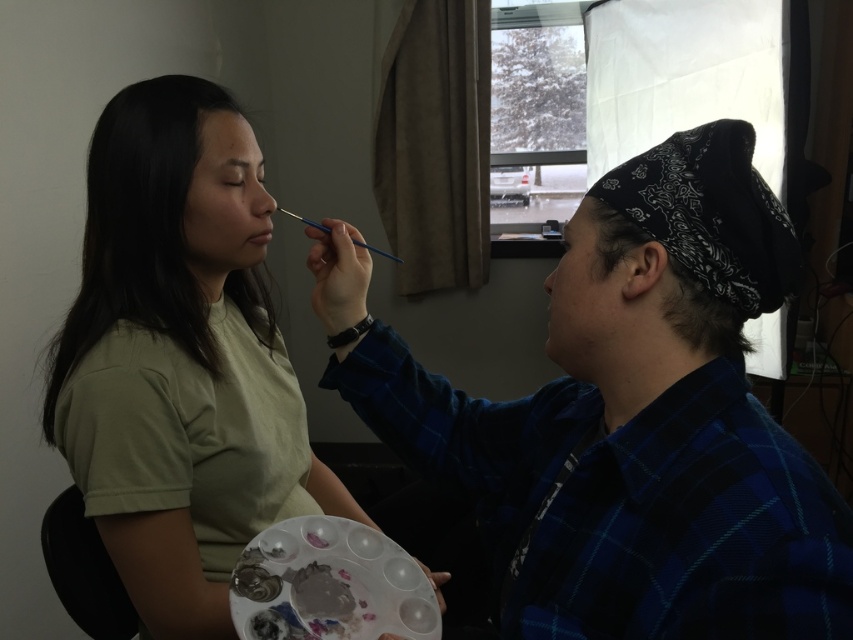
Question: Can you confirm if matte green shirt at left is smaller than matte black bandana at right?

Choices:
 (A) yes
 (B) no

Answer: (B)

Question: Based on their relative distances, which object is nearer to the blue plaid shirt at right?

Choices:
 (A) matte black bandana at right
 (B) matte skin forehead at upper center

Answer: (A)

Question: Can you confirm if blue plaid shirt at right is wider than matte green shirt at left?

Choices:
 (A) no
 (B) yes

Answer: (B)

Question: Which of these objects is positioned farthest from the matte skin forehead at upper center?

Choices:
 (A) blue plaid shirt at right
 (B) matte skin at center

Answer: (A)

Question: Which of the following is the closest to the observer?

Choices:
 (A) matte skin at center
 (B) matte black bandana at right

Answer: (B)

Question: In this image, where is blue plaid shirt at right located relative to matte skin at center?

Choices:
 (A) right
 (B) left

Answer: (A)